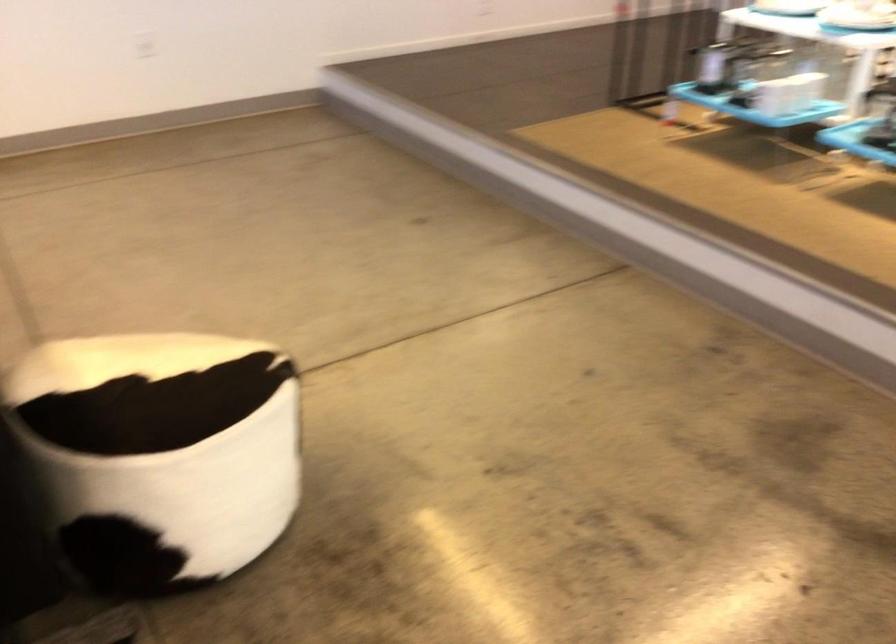
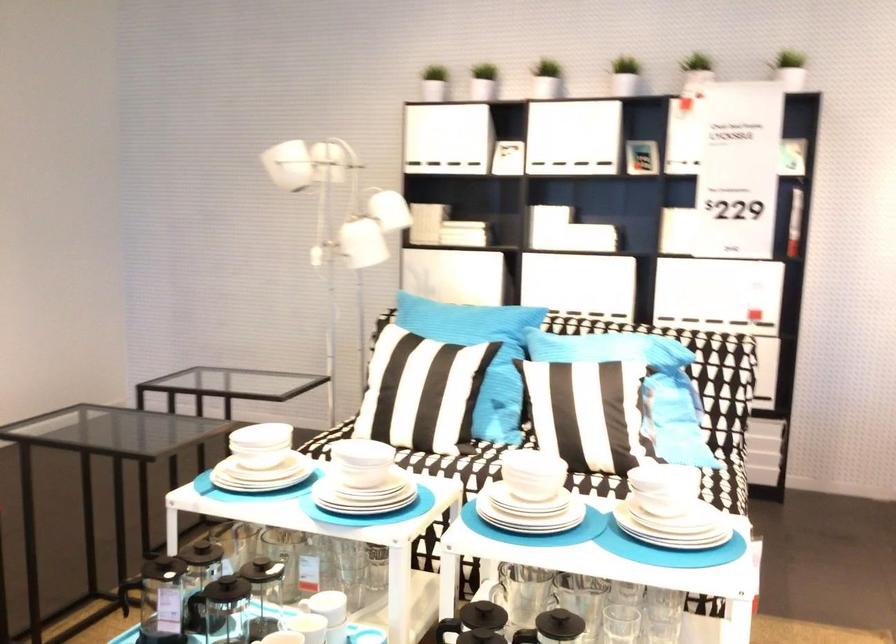
Find the pixel in the second image that matches [813,76] in the first image.

(329, 605)